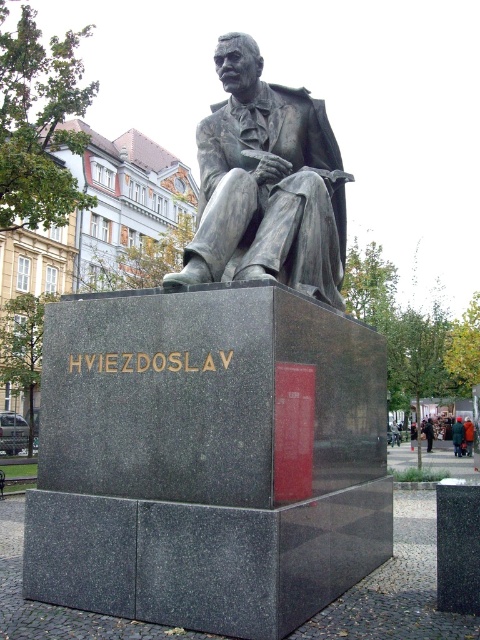
Between polished bronze statue at center and dark gray suit at center, which one is positioned lower?

dark gray suit at center is below.

Is point (278, 412) in front of point (423, 428)?

That is True.

The height and width of the screenshot is (640, 480). What do you see at coordinates (220, 397) in the screenshot?
I see `polished bronze statue at center` at bounding box center [220, 397].

At what (x,y) coordinates should I click in order to perform the action: click on polished bronze statue at center. Please return your answer as a coordinate pair (x, y). Looking at the image, I should click on (220, 397).

Can you confirm if polished bronze statue at center is shorter than bronze statue at center?

No.

The image size is (480, 640). I want to click on polished bronze statue at center, so click(x=220, y=397).

Where is `polished bronze statue at center`? Image resolution: width=480 pixels, height=640 pixels. polished bronze statue at center is located at coordinates (220, 397).

Which is in front, point (256, 172) or point (424, 426)?

Point (256, 172)

Does bronze statue at center have a lesser height compared to dark gray suit at center?

No, bronze statue at center is not shorter than dark gray suit at center.

Where is `bronze statue at center`? The width and height of the screenshot is (480, 640). bronze statue at center is located at coordinates (266, 184).